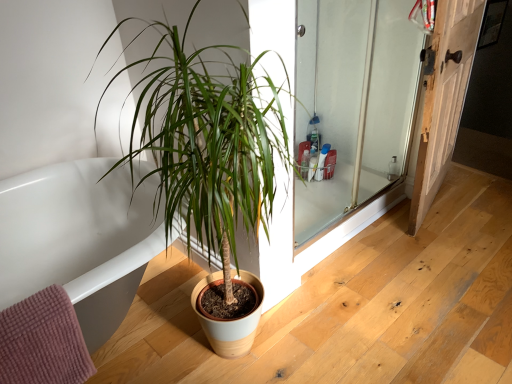
Where is `vacant space to the right of green matte plant at center`? This screenshot has width=512, height=384. vacant space to the right of green matte plant at center is located at coordinates (371, 314).